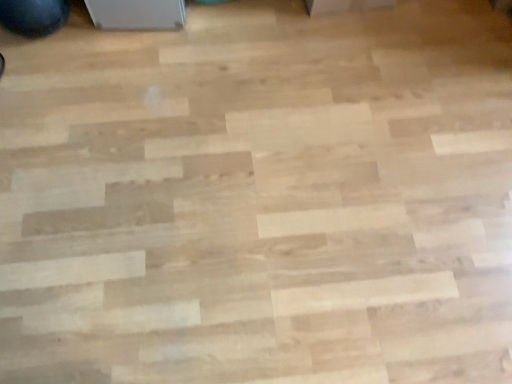
The image size is (512, 384). I want to click on vacant space in front of matte black shoe at upper left, so click(41, 73).